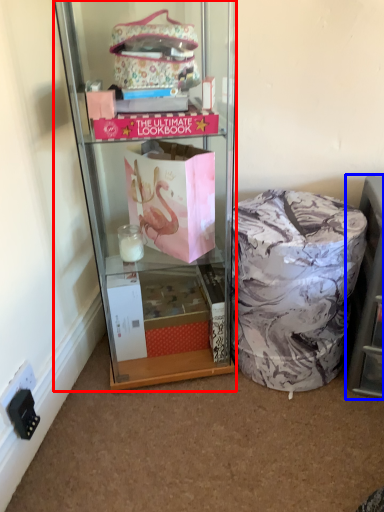
Question: Which point is closer to the camera, cabinetry (highlighted by a red box) or shelf (highlighted by a blue box)?

Choices:
 (A) cabinetry
 (B) shelf

Answer: (A)